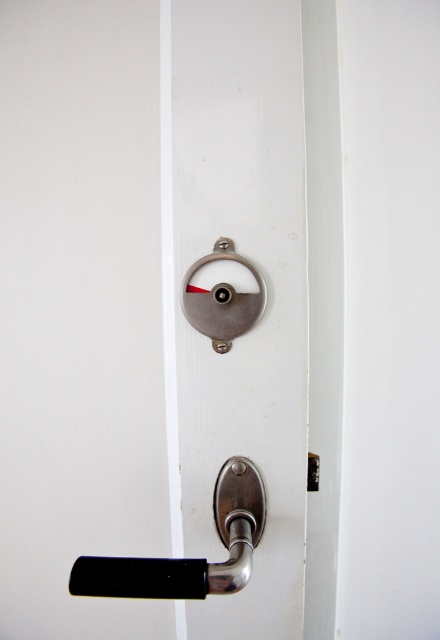
Question: Is black matte door handle at lower center thinner than satin silver lock at center?

Choices:
 (A) yes
 (B) no

Answer: (B)

Question: Which of the following is the farthest from the observer?

Choices:
 (A) black matte door handle at lower center
 (B) metallic silver lock at center
 (C) satin silver lock at center

Answer: (B)

Question: Does metallic silver lock at center have a smaller size compared to satin silver lock at center?

Choices:
 (A) no
 (B) yes

Answer: (A)

Question: Does black matte door handle at lower center have a greater width compared to satin silver lock at center?

Choices:
 (A) no
 (B) yes

Answer: (B)

Question: Which of the following is the closest to the observer?

Choices:
 (A) metallic silver lock at center
 (B) black matte door handle at lower center

Answer: (B)

Question: Estimate the real-world distances between objects in this image. Which object is farther from the metallic silver lock at center?

Choices:
 (A) black matte door handle at lower center
 (B) satin silver lock at center

Answer: (B)